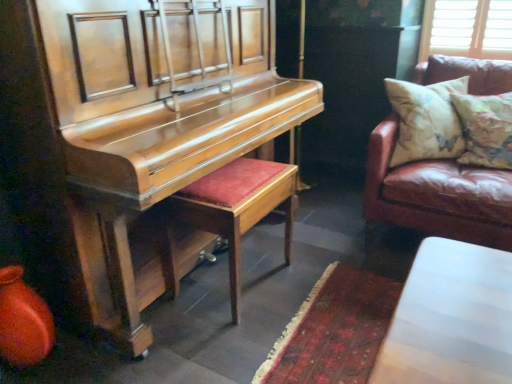
Question: From the image's perspective, is brown leather couch at right on top of shiny wood harpsichord at left?

Choices:
 (A) no
 (B) yes

Answer: (B)

Question: From the image's perspective, is brown leather couch at right beneath shiny wood harpsichord at left?

Choices:
 (A) no
 (B) yes

Answer: (A)

Question: Considering the relative positions of brown leather couch at right and shiny wood harpsichord at left in the image provided, is brown leather couch at right to the left of shiny wood harpsichord at left from the viewer's perspective?

Choices:
 (A) yes
 (B) no

Answer: (B)

Question: Is brown leather couch at right further to the viewer compared to shiny wood harpsichord at left?

Choices:
 (A) no
 (B) yes

Answer: (B)

Question: Is shiny wood harpsichord at left inside brown leather couch at right?

Choices:
 (A) yes
 (B) no

Answer: (B)

Question: Is leather couch at right bigger or smaller than velvet red stool at center?

Choices:
 (A) small
 (B) big

Answer: (A)

Question: Is leather couch at right inside or outside of velvet red stool at center?

Choices:
 (A) inside
 (B) outside

Answer: (B)

Question: Is point (374, 223) closer or farther from the camera than point (217, 210)?

Choices:
 (A) farther
 (B) closer

Answer: (A)

Question: Is leather couch at right wider or thinner than velvet red stool at center?

Choices:
 (A) wide
 (B) thin

Answer: (B)

Question: In terms of width, does brown leather couch at right look wider or thinner when compared to velvet red stool at center?

Choices:
 (A) wide
 (B) thin

Answer: (B)

Question: Is brown leather couch at right taller or shorter than velvet red stool at center?

Choices:
 (A) short
 (B) tall

Answer: (B)

Question: From a real-world perspective, is brown leather couch at right positioned above or below velvet red stool at center?

Choices:
 (A) above
 (B) below

Answer: (A)

Question: Considering the positions of brown leather couch at right and velvet red stool at center in the image, is brown leather couch at right bigger or smaller than velvet red stool at center?

Choices:
 (A) small
 (B) big

Answer: (A)

Question: Is brown leather couch at right inside or outside of floral fabric cushion at right?

Choices:
 (A) inside
 (B) outside

Answer: (B)

Question: Based on their positions, is brown leather couch at right located to the left or right of floral fabric cushion at right?

Choices:
 (A) right
 (B) left

Answer: (B)